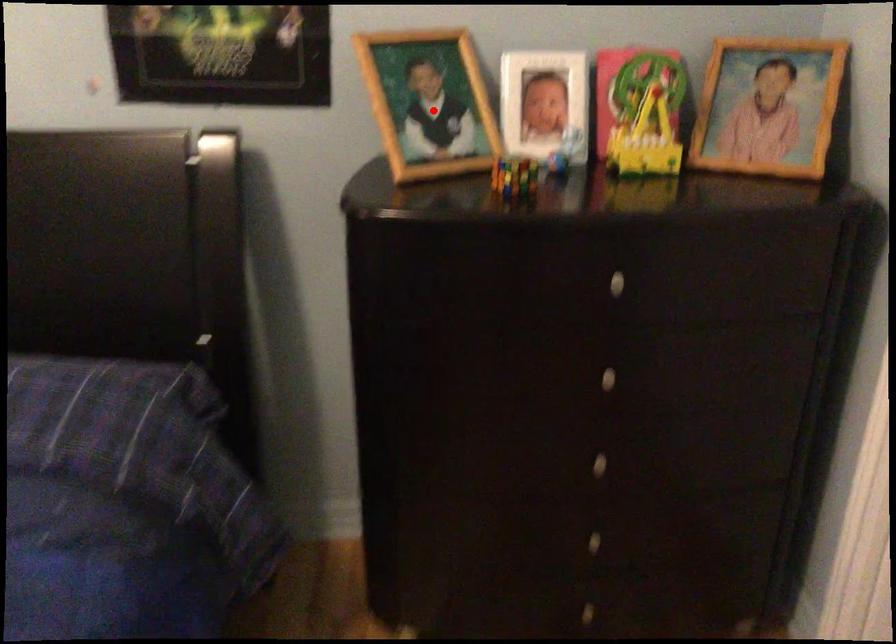
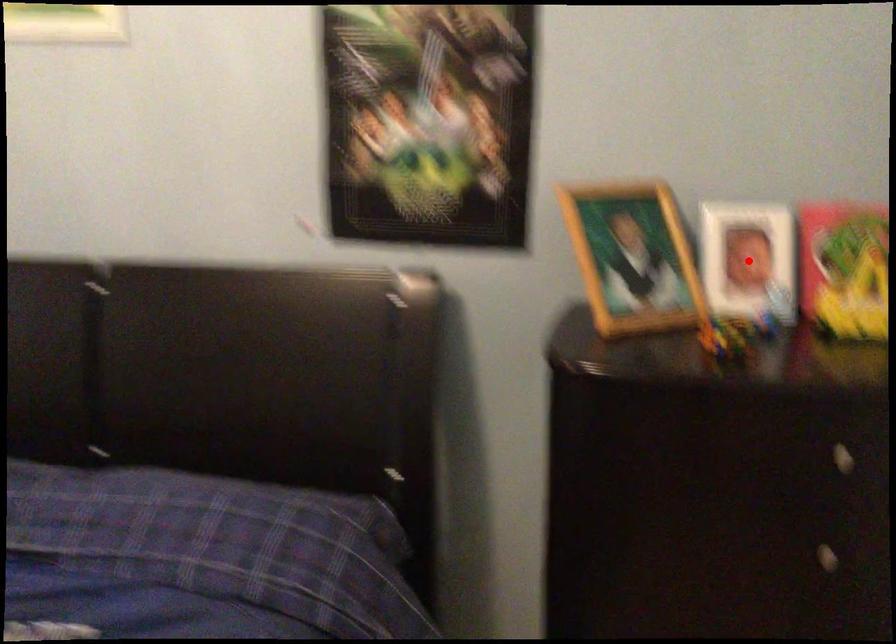
I am providing you with two images of the same scene from different viewpoints. A red point is marked on the first image and another point is marked on the second image. Are the points marked in image1 and image2 representing the same 3D position?

No